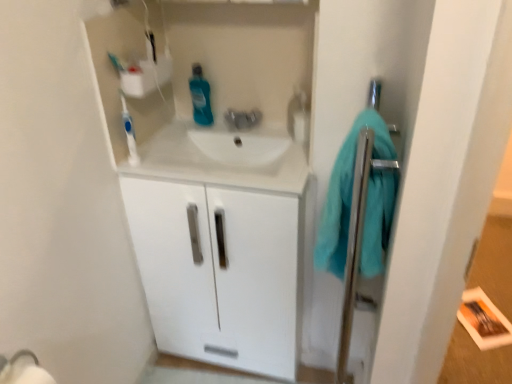
This screenshot has height=384, width=512. I want to click on free space to the right of blue glossy mouthwash at center, so click(x=230, y=127).